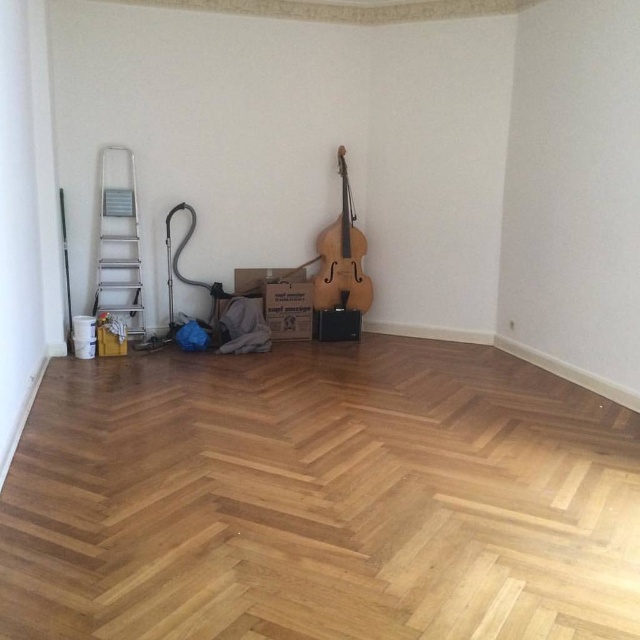
Can you confirm if silver metallic ladder at left is smaller than wooden cello at center?

Yes, silver metallic ladder at left is smaller than wooden cello at center.

Is silver metallic ladder at left below wooden cello at center?

Yes.

Who is more forward, (118, 246) or (364, 243)?

Positioned in front is point (118, 246).

At what (x,y) coordinates should I click in order to perform the action: click on silver metallic ladder at left. Please return your answer as a coordinate pair (x, y). Looking at the image, I should click on (118, 241).

Between wooden cello at center and brown cardboard box at center, which one has more height?

wooden cello at center

Does wooden cello at center have a larger size compared to brown cardboard box at center?

Yes, wooden cello at center is bigger than brown cardboard box at center.

Consider the image. Who is more distant from viewer, (326, 269) or (296, 323)?

The point (326, 269) is more distant.

The height and width of the screenshot is (640, 640). I want to click on wooden cello at center, so click(x=340, y=257).

Does brown cardboard box at center have a greater height compared to brown cardboard box at lower left?

Yes.

Can you confirm if brown cardboard box at center is wider than brown cardboard box at lower left?

Yes, brown cardboard box at center is wider than brown cardboard box at lower left.

Is point (289, 316) behind point (106, 330)?

Yes, it is.

Find the location of a particular element. The height and width of the screenshot is (640, 640). brown cardboard box at center is located at coordinates (289, 308).